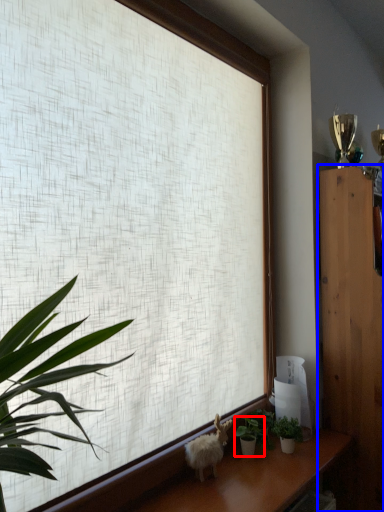
Question: Among these objects, which one is nearest to the camera, houseplant (highlighted by a red box) or furniture (highlighted by a blue box)?

Choices:
 (A) houseplant
 (B) furniture

Answer: (A)